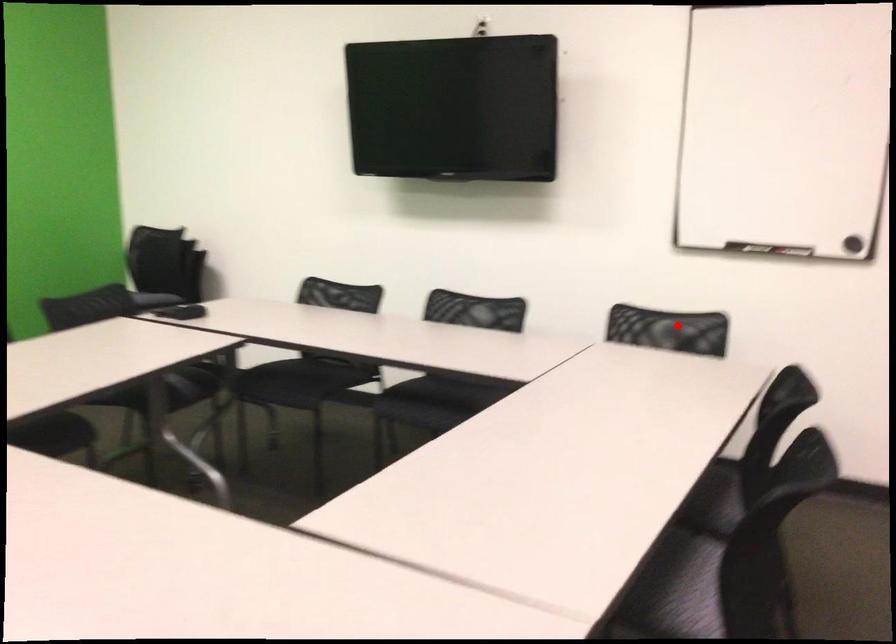
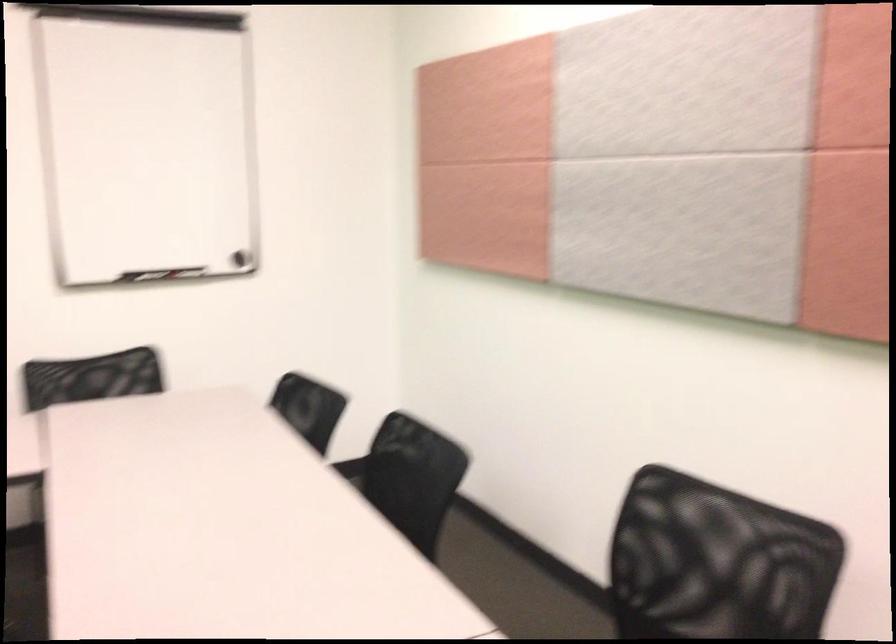
Locate, in the second image, the point that corresponds to the highlighted location in the first image.

(91, 377)